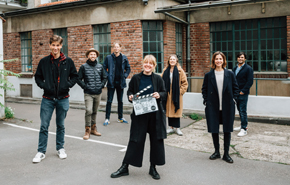
Where is `brick wall`? This screenshot has width=290, height=185. brick wall is located at coordinates (78, 40), (127, 37), (13, 46), (197, 42).